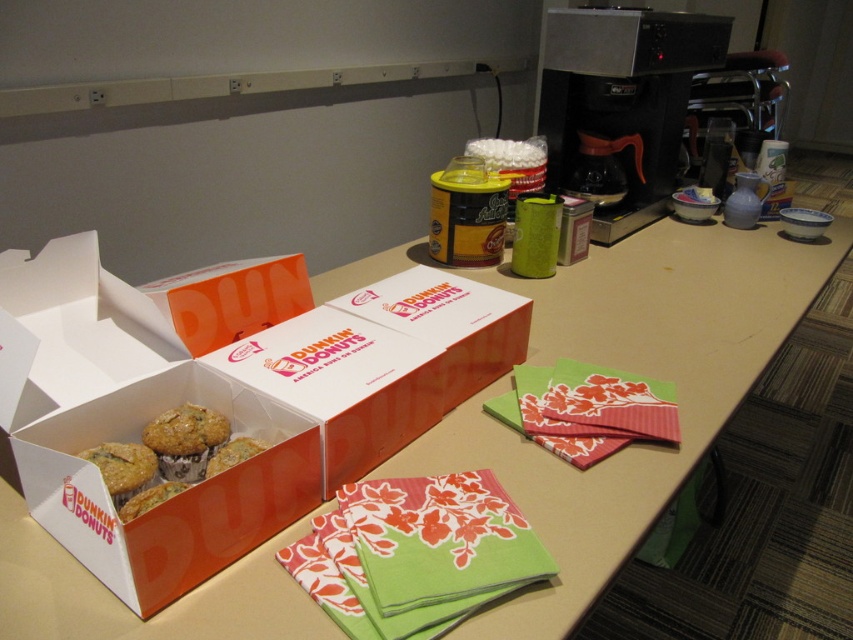
Question: Which point is closer to the camera?

Choices:
 (A) (515, 400)
 (B) (131, 477)
 (C) (122, 490)
 (D) (712, 435)

Answer: (C)

Question: Can you confirm if orange cardboard box at center is positioned above golden brown muffin at lower left?

Choices:
 (A) no
 (B) yes

Answer: (B)

Question: Does golden-brown muffin at center have a lesser width compared to golden brown muffin at lower left?

Choices:
 (A) no
 (B) yes

Answer: (A)

Question: Is floral-patterned paper at lower center positioned before orange matte dunkin' donuts box at center?

Choices:
 (A) no
 (B) yes

Answer: (B)

Question: Which point is farther to the camera?

Choices:
 (A) coord(148,474)
 (B) coord(593,598)

Answer: (A)

Question: Which object is closer to the camera taking this photo?

Choices:
 (A) golden-brown muffin at center
 (B) floral-patterned paper at lower center
 (C) orange cardboard box at center

Answer: (B)